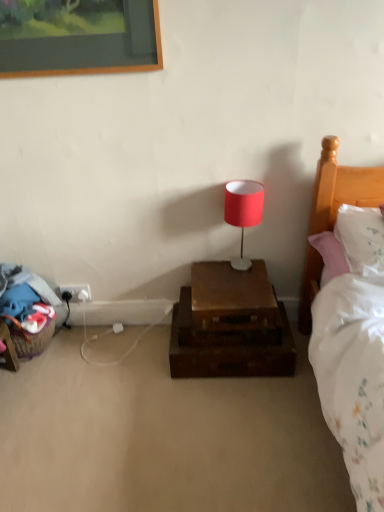
Locate an element on the screen. This screenshot has width=384, height=512. free space in front of matte red lampshade at center is located at coordinates (237, 291).